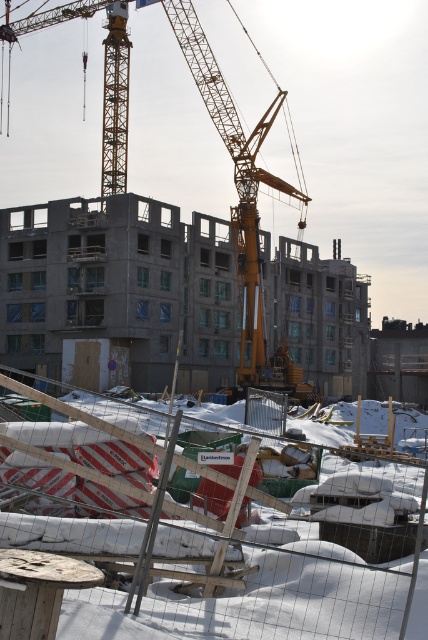
Question: Which object is farther from the camera taking this photo?

Choices:
 (A) yellow metallic crane at center
 (B) white plastic fencing at lower center

Answer: (A)

Question: Is white plastic fencing at lower center closer to the viewer compared to yellow metallic crane at center?

Choices:
 (A) no
 (B) yes

Answer: (B)

Question: Does white plastic fencing at lower center appear on the right side of yellow metallic crane at center?

Choices:
 (A) yes
 (B) no

Answer: (A)

Question: Is white plastic fencing at lower center closer to the viewer compared to yellow metallic crane at center?

Choices:
 (A) yes
 (B) no

Answer: (A)